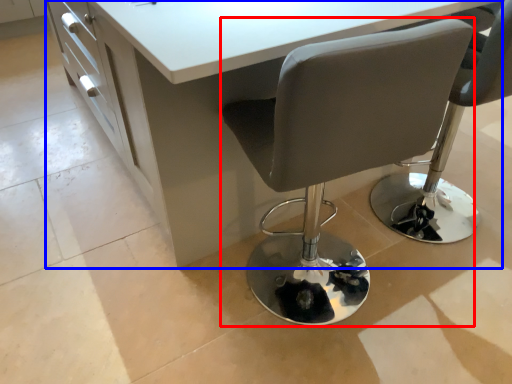
Question: Among these objects, which one is farthest to the camera, chair (highlighted by a red box) or table (highlighted by a blue box)?

Choices:
 (A) chair
 (B) table

Answer: (B)